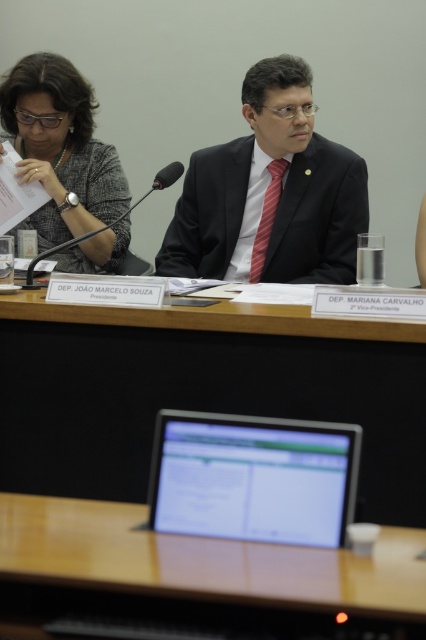
You are standing in front of the smooth wooden table at center and want to place a 5.5 feet long document on it. Can the table accommodate the document without overhanging?

The smooth wooden table at center is 5.61 feet from viewer, so the document will fit since it is shorter than the table length.

You are organizing a conference and need to place a decorative item on the wooden table at center. The item you have is exactly the same width as the black matte microphone at upper center. Will this item fit on the table without exceeding its width?

The wooden table at center is wider than the black matte microphone at upper center, so the decorative item with the same width as the microphone will fit on the table without exceeding its width.